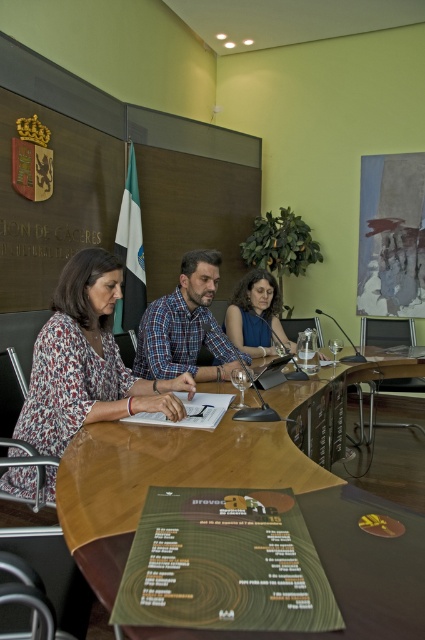
You are a photographer in the room and want to capture a clear photo of both the blue plaid shirt at center and the matte black hair at center. Which object should you focus on first to ensure both are in focus?

The blue plaid shirt at center is much taller than the matte black hair at center. To ensure both are in focus, you should focus on the blue plaid shirt at center first since it is farther away.

From the picture: You are attending a meeting in this room and need to place a small notebook on the wooden table at center. However, you are wearing the floral fabric blouse at left. Could the notebook placed on the table be visible above the blouse when seated?

The wooden table at center is not as tall as the floral fabric blouse at left, so the notebook placed on the table would not be visible above the blouse when seated.

You are standing at the entrance of the room and want to greet the person wearing the blue plaid shirt at center. Which direction should you walk to reach them?

The blue plaid shirt at center is located at point 0.511 on the x axis and 0.435 on the y axis, so you should walk towards the center of the room to reach them.